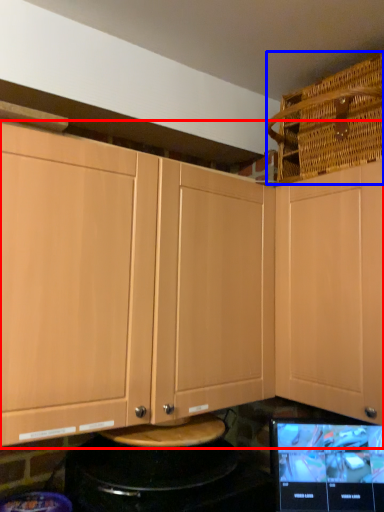
Question: Which object is further to the camera taking this photo, cabinetry (highlighted by a red box) or basket (highlighted by a blue box)?

Choices:
 (A) cabinetry
 (B) basket

Answer: (B)